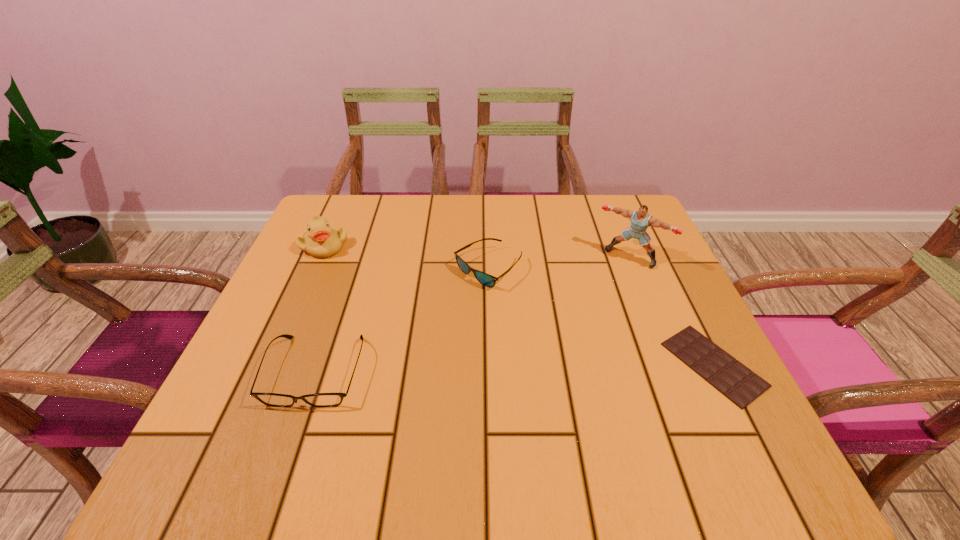
I want to click on spectacles, so click(270, 399).

At what (x,y) coordinates should I click in order to perform the action: click on the shortest object. Please return your answer as a coordinate pair (x, y). The width and height of the screenshot is (960, 540). Looking at the image, I should click on (738, 383).

This screenshot has height=540, width=960. Find the location of `sunglasses`. sunglasses is located at coordinates (485, 279).

In order to click on the fourth shortest object in this screenshot , I will do `click(322, 240)`.

Image resolution: width=960 pixels, height=540 pixels. I want to click on the tallest object, so click(640, 220).

Locate an element on the screen. The height and width of the screenshot is (540, 960). vacant position located 0.240m on the left of the shortest object is located at coordinates (542, 364).

Where is `free space located 0.300m at the front of the sunglasses showing the lenses`? free space located 0.300m at the front of the sunglasses showing the lenses is located at coordinates (459, 408).

You are a GUI agent. You are given a task and a screenshot of the screen. Output one action in this format:
    pyautogui.click(x=<x>, y=<y>)
    Task: Click on the vacant area situated at the front of the sunglasses showing the lenses
    The image size is (960, 540).
    Given the screenshot: What is the action you would take?
    pyautogui.click(x=458, y=413)

Where is `free spot located at the front of the sunglasses showing the lenses`? The height and width of the screenshot is (540, 960). free spot located at the front of the sunglasses showing the lenses is located at coordinates (474, 335).

The height and width of the screenshot is (540, 960). In order to click on vacant region located 0.210m on the front-facing side of the second tallest object in this screenshot , I will do `click(389, 297)`.